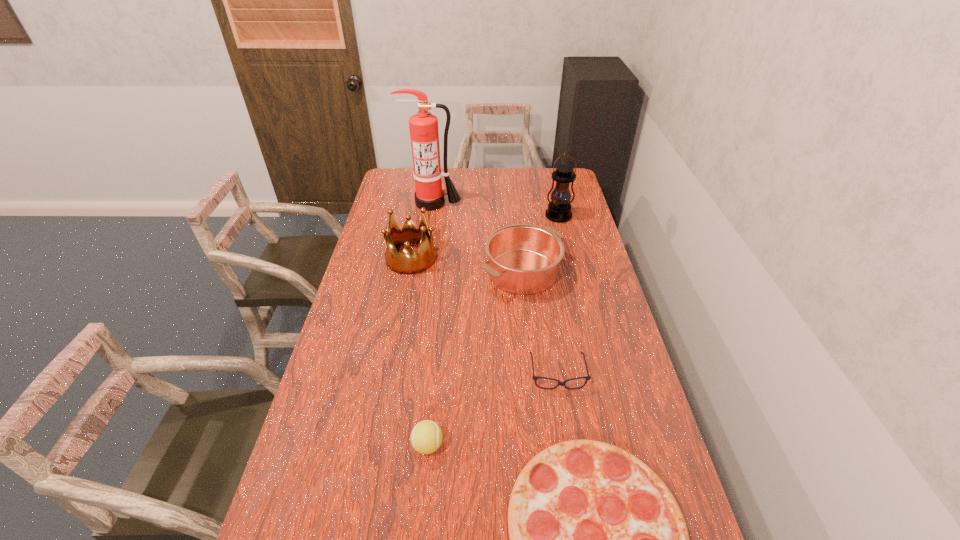
What are the coordinates of `blank area at the right edge` in the screenshot? It's located at (625, 416).

Where is `free region at the far right corner of the desktop`? free region at the far right corner of the desktop is located at coordinates (555, 181).

I want to click on empty space that is in between the fifth farthest object and the sixth shortest object, so click(x=558, y=295).

Identify the location of unoccupied area between the fire extinguisher and the third shortest object. (430, 324).

Identify the location of vacant space that is in between the fifth farthest object and the fire extinguisher. The image size is (960, 540). (495, 289).

Where is `blank region between the tallest object and the second shortest object`? The height and width of the screenshot is (540, 960). blank region between the tallest object and the second shortest object is located at coordinates (495, 289).

The height and width of the screenshot is (540, 960). Find the location of `empty location between the fire extinguisher and the spectacles`. empty location between the fire extinguisher and the spectacles is located at coordinates (495, 289).

The image size is (960, 540). What are the coordinates of `free point between the spectacles and the tennis ball` in the screenshot? It's located at (492, 410).

Locate an element on the screen. The width and height of the screenshot is (960, 540). vacant point located between the fire extinguisher and the second shortest object is located at coordinates (495, 289).

Where is `free point between the fifth farthest object and the fire extinguisher`? The height and width of the screenshot is (540, 960). free point between the fifth farthest object and the fire extinguisher is located at coordinates [x=495, y=289].